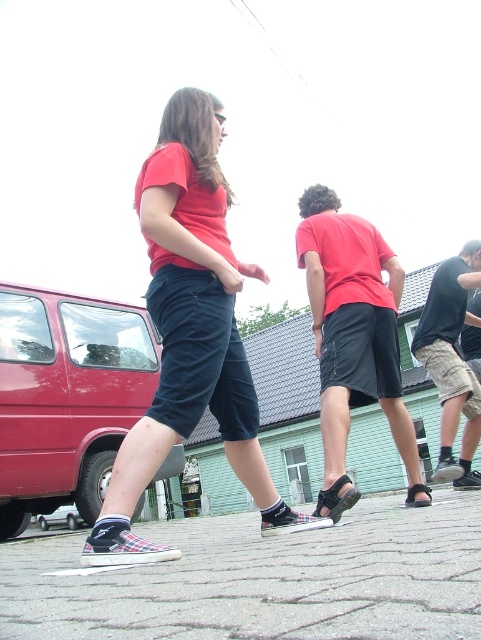
Question: Estimate the real-world distances between objects in this image. Which object is farther from the matte red t-shirt at center?

Choices:
 (A) dark gray camo shorts at right
 (B) matte black shorts at center

Answer: (B)

Question: In this image, where is matte black shorts at center located relative to dark gray camo shorts at right?

Choices:
 (A) left
 (B) right

Answer: (A)

Question: Which point appears closest to the camera in this image?

Choices:
 (A) (119, 538)
 (B) (302, 205)
 (C) (468, 445)
 (D) (63, 493)

Answer: (A)

Question: Can you confirm if metallic red van at lower left is smaller than matte red t-shirt at center?

Choices:
 (A) no
 (B) yes

Answer: (A)

Question: Can you confirm if metallic red van at lower left is smaller than matte red t-shirt at center?

Choices:
 (A) no
 (B) yes

Answer: (A)

Question: Which point appears closest to the camera in this image?

Choices:
 (A) (480, 276)
 (B) (98, 320)
 (C) (379, 275)
 (D) (210, 285)

Answer: (D)